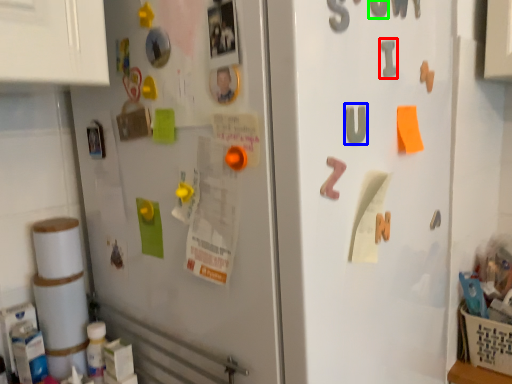
Question: Which is nearer to the alphabet (highlighted by a red box)? alphabet (highlighted by a blue box) or number (highlighted by a green box).

Choices:
 (A) alphabet
 (B) number

Answer: (B)